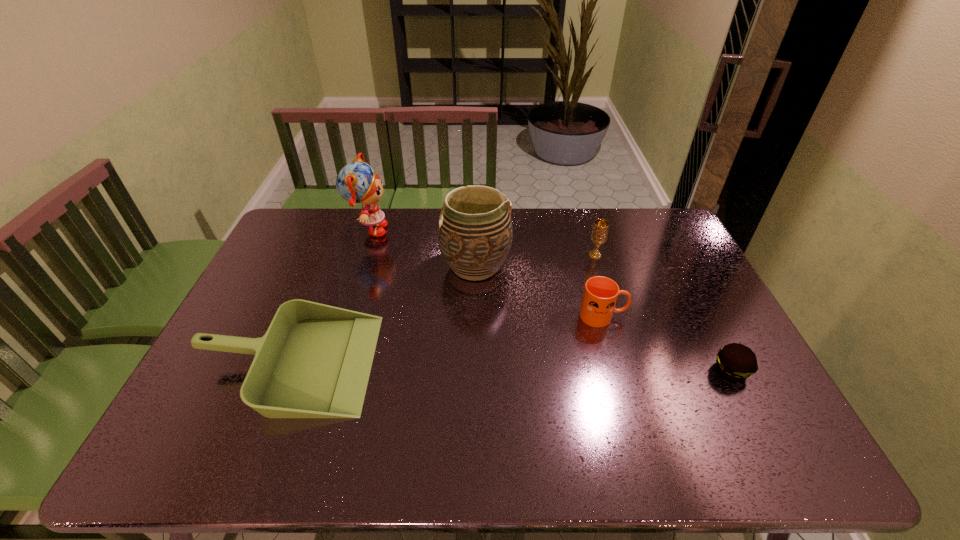
Where is `vacant position in the image that satisfies the following two spatial constraints: 1. on the handle side of the mug; 2. on the left side of the rightmost object`? The image size is (960, 540). vacant position in the image that satisfies the following two spatial constraints: 1. on the handle side of the mug; 2. on the left side of the rightmost object is located at coordinates (617, 370).

At what (x,y) coordinates should I click in order to perform the action: click on vacant space that satisfies the following two spatial constraints: 1. on the scoop of the patty; 2. on the left side of the dustpan. Please return your answer as a coordinate pair (x, y). This screenshot has height=540, width=960. Looking at the image, I should click on (286, 370).

Where is `vacant area in the image that satisfies the following two spatial constraints: 1. on the scoop of the dustpan; 2. on the back side of the rightmost object`? Image resolution: width=960 pixels, height=540 pixels. vacant area in the image that satisfies the following two spatial constraints: 1. on the scoop of the dustpan; 2. on the back side of the rightmost object is located at coordinates (286, 370).

Where is `free region that satisfies the following two spatial constraints: 1. on the scoop of the dustpan; 2. on the back side of the shortest object`? This screenshot has height=540, width=960. free region that satisfies the following two spatial constraints: 1. on the scoop of the dustpan; 2. on the back side of the shortest object is located at coordinates (286, 370).

Where is `vacant region that satisfies the following two spatial constraints: 1. on the face of the chalice; 2. on the right side of the doll`? This screenshot has width=960, height=540. vacant region that satisfies the following two spatial constraints: 1. on the face of the chalice; 2. on the right side of the doll is located at coordinates (361, 255).

You are a GUI agent. You are given a task and a screenshot of the screen. Output one action in this format:
    pyautogui.click(x=<x>, y=<y>)
    Task: Click on the vacant space that satisfies the following two spatial constraints: 1. on the handle side of the shortest object; 2. on the right side of the mug
    Image resolution: width=960 pixels, height=540 pixels.
    Given the screenshot: What is the action you would take?
    pyautogui.click(x=617, y=370)

At what (x,y) coordinates should I click in order to perform the action: click on vacant position in the image that satisfies the following two spatial constraints: 1. on the scoop of the dustpan; 2. on the left side of the shortest object. Please return your answer as a coordinate pair (x, y). Image resolution: width=960 pixels, height=540 pixels. Looking at the image, I should click on (286, 370).

Where is `free space that satisfies the following two spatial constraints: 1. on the handle side of the mug; 2. on the right side of the rightmost object`? This screenshot has height=540, width=960. free space that satisfies the following two spatial constraints: 1. on the handle side of the mug; 2. on the right side of the rightmost object is located at coordinates (617, 370).

Find the location of a particular element. free location that satisfies the following two spatial constraints: 1. on the face of the chalice; 2. on the right side of the doll is located at coordinates (361, 255).